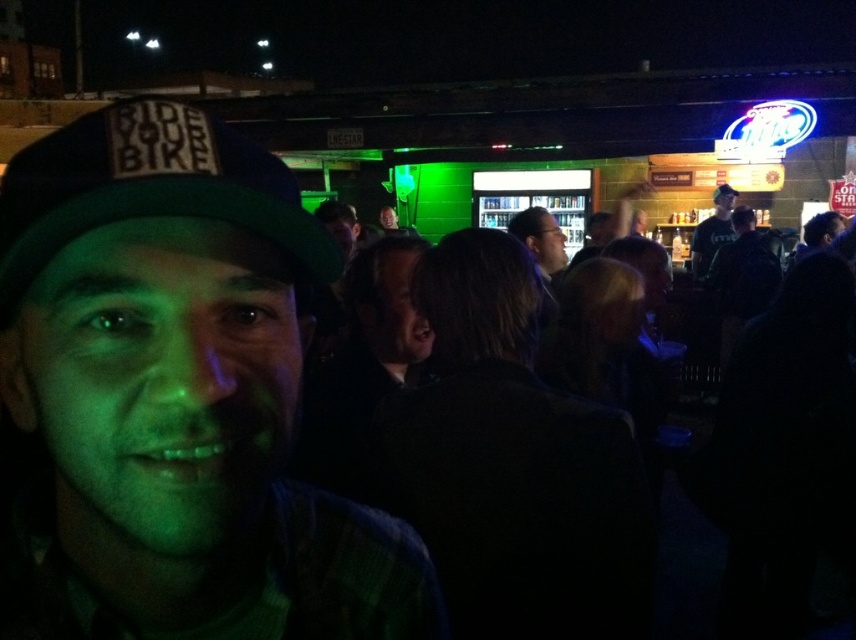
Question: Estimate the real-world distances between objects in this image. Which object is closer to the dark clothing at center?

Choices:
 (A) matte green cap at center
 (B) dark blue shirt at center
 (C) green fabric cap at center

Answer: (A)

Question: Which object is positioned farthest from the dark blue shirt at center?

Choices:
 (A) matte green cap at center
 (B) green fabric cap at center
 (C) dark clothing at center

Answer: (A)

Question: Does green fabric cap at upper left appear on the left side of dark blue shirt at center?

Choices:
 (A) yes
 (B) no

Answer: (A)

Question: Which object appears closest to the camera in this image?

Choices:
 (A) dark blue shirt at center
 (B) matte green cap at center
 (C) green fabric cap at upper left
 (D) green fabric cap at center

Answer: (B)

Question: Is dark blue shirt at center closer to camera compared to green fabric cap at center?

Choices:
 (A) yes
 (B) no

Answer: (A)

Question: Where is dark clothing at center located in relation to dark blue shirt at center in the image?

Choices:
 (A) below
 (B) above

Answer: (A)